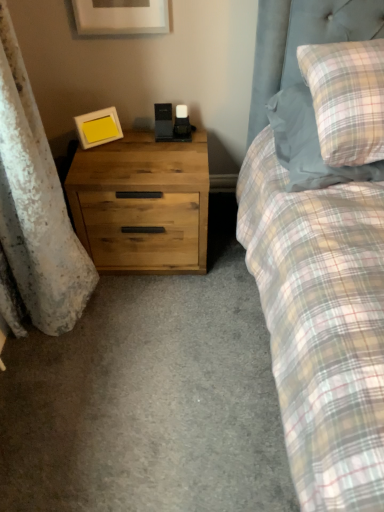
Locate an element on the screen. The height and width of the screenshot is (512, 384). free space in front of matte yellow picture frame at left, the second picture frame viewed from the top is located at coordinates (104, 162).